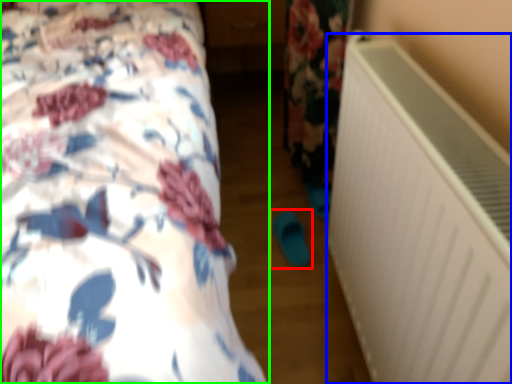
Question: Based on their relative distances, which object is nearer to footwear (highlighted by a red box)? Choose from air conditioning (highlighted by a blue box) and bed (highlighted by a green box).

Choices:
 (A) air conditioning
 (B) bed

Answer: (A)